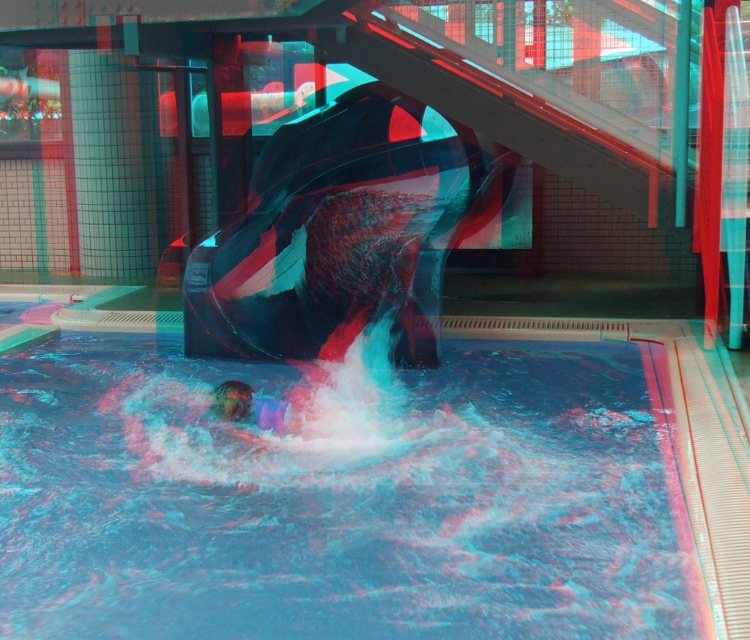
You are standing at the entrance of the water park and see the blue rubber pool at center and the translucent purple swimmer at center. Which object is positioned to the right side?

The blue rubber pool at center is to the right of the translucent purple swimmer at center.